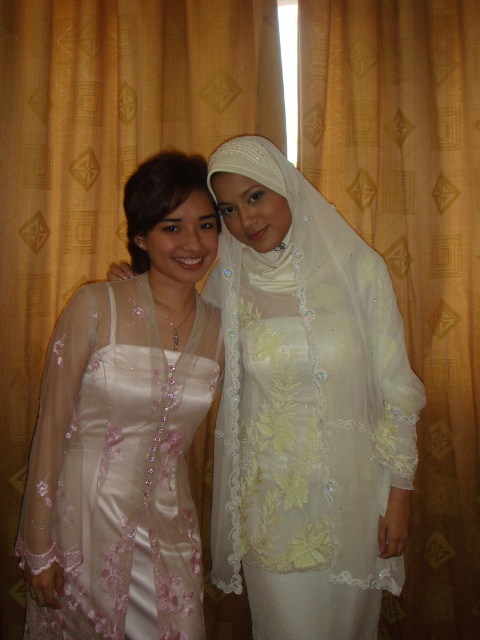
Question: Is satin white dress at center thinner than satin dress at left?

Choices:
 (A) no
 (B) yes

Answer: (A)

Question: Considering the relative positions of satin white dress at center and satin dress at left in the image provided, where is satin white dress at center located with respect to satin dress at left?

Choices:
 (A) right
 (B) left

Answer: (A)

Question: Is satin white dress at center wider than satin dress at left?

Choices:
 (A) yes
 (B) no

Answer: (A)

Question: Which point is farther to the camera?

Choices:
 (A) satin white dress at center
 (B) satin dress at left

Answer: (A)